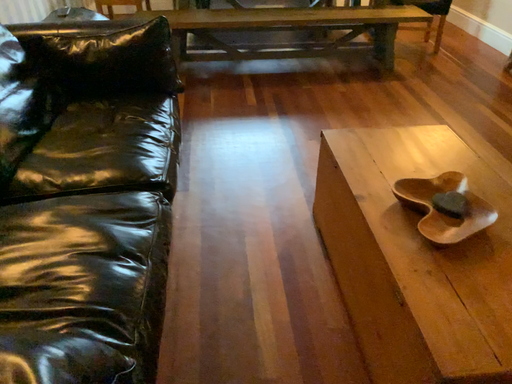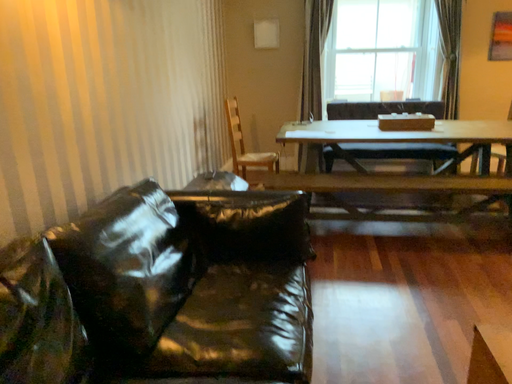
Question: How did the camera likely rotate when shooting the video?

Choices:
 (A) rotated downward
 (B) rotated upward

Answer: (B)